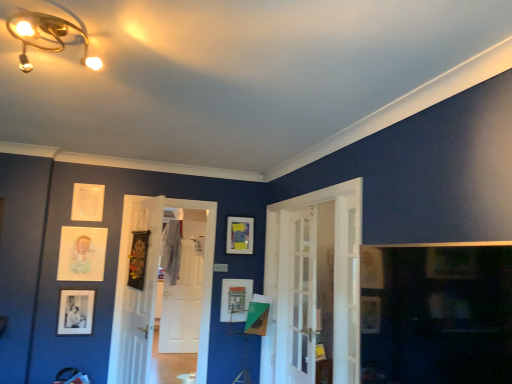
Question: Considering the positions of point (233, 316) and point (89, 246), is point (233, 316) closer or farther from the camera than point (89, 246)?

Choices:
 (A) closer
 (B) farther

Answer: (B)

Question: Is matte white picture frame at center, arranged as the 2th picture frame when viewed from the right, spatially inside matte paper picture frame at upper left, arranged as the fourth picture frame when viewed from the right, or outside of it?

Choices:
 (A) outside
 (B) inside

Answer: (A)

Question: Which is farther from the gold metallic light fixture at upper left?

Choices:
 (A) matte paper picture frame at upper left, which is counted as the 2th picture frame, starting from the left
 (B) clear glass screen door at center
 (C) black matte picture frame at lower left, the 5th picture frame viewed from the right
 (D) wooden textured picture frame at center, which is counted as the 3th picture frame, starting from the right
 (E) white wooden door at center, positioned as the 2th door in back-to-front order

Answer: (C)

Question: Which object is the closest to the clear glass screen door at center?

Choices:
 (A) matte yellow picture frame at center, arranged as the 1th picture frame when viewed from the right
 (B) white matte door at center, positioned as the second door in left-to-right order
 (C) matte white picture frame at center, arranged as the 2th picture frame when viewed from the right
 (D) black matte picture frame at lower left, acting as the first picture frame starting from the left
 (E) matte paper picture frame at upper left, arranged as the fourth picture frame when viewed from the right

Answer: (C)